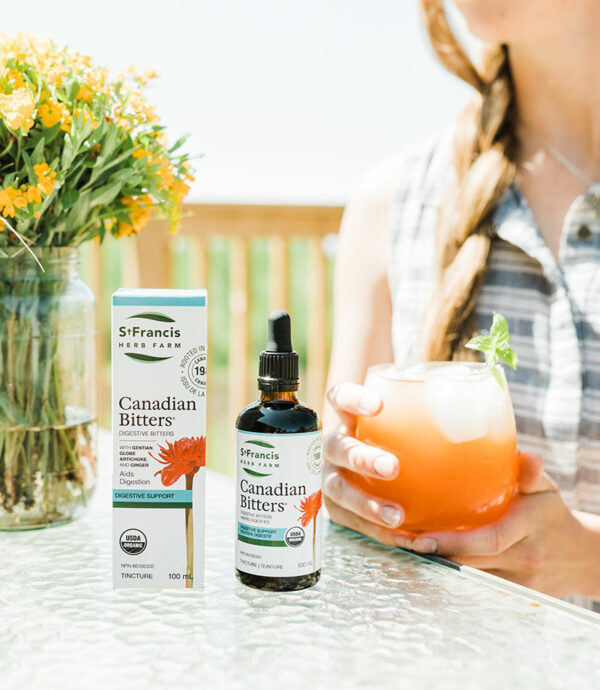
Where is `glass bottle`? This screenshot has height=690, width=600. glass bottle is located at coordinates (286, 422).